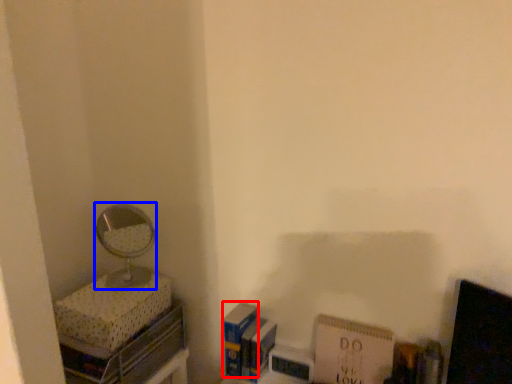
Question: Which object is further to the camera taking this photo, paperback book (highlighted by a red box) or mirror (highlighted by a blue box)?

Choices:
 (A) paperback book
 (B) mirror

Answer: (A)